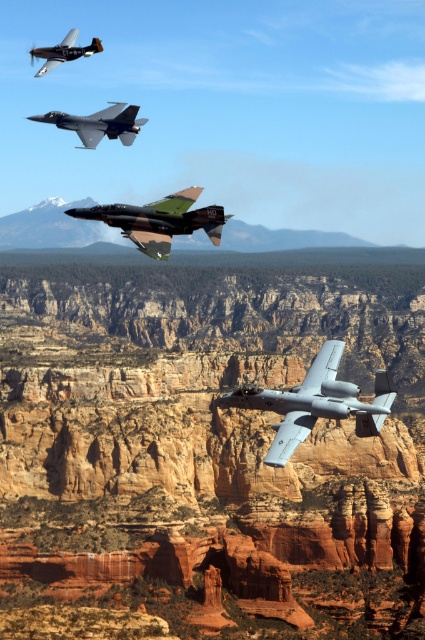
Can you confirm if silver metallic jet at center is shorter than camouflage paint fighter jet at center?

Indeed, silver metallic jet at center has a lesser height compared to camouflage paint fighter jet at center.

Looking at this image, which is more to the left, silver metallic jet at center or camouflage paint fighter jet at center?

From the viewer's perspective, camouflage paint fighter jet at center appears more on the left side.

Who is more distant from viewer, (246, 404) or (218, 237)?

Positioned behind is point (246, 404).

Where is `silver metallic jet at center`? This screenshot has width=425, height=640. silver metallic jet at center is located at coordinates (316, 403).

Can you confirm if rustic stone cliff at center is positioned above silver metallic jet at center?

Yes, rustic stone cliff at center is above silver metallic jet at center.

What do you see at coordinates (204, 451) in the screenshot?
I see `rustic stone cliff at center` at bounding box center [204, 451].

At what (x,y) coordinates should I click in order to perform the action: click on rustic stone cliff at center. Please return your answer as a coordinate pair (x, y). This screenshot has height=640, width=425. Looking at the image, I should click on (204, 451).

This screenshot has width=425, height=640. Identify the location of rustic stone cliff at center. (204, 451).

Consider the image. Is rustic stone cliff at center below camouflage paint fighter jet at center?

Indeed, rustic stone cliff at center is positioned under camouflage paint fighter jet at center.

Between rustic stone cliff at center and camouflage paint fighter jet at center, which one has less height?

rustic stone cliff at center is shorter.

Which is behind, point (422, 600) or point (73, 216)?

The point (422, 600) is behind.

At what (x,y) coordinates should I click in order to perform the action: click on rustic stone cliff at center. Please return your answer as a coordinate pair (x, y). The width and height of the screenshot is (425, 640). Looking at the image, I should click on (204, 451).